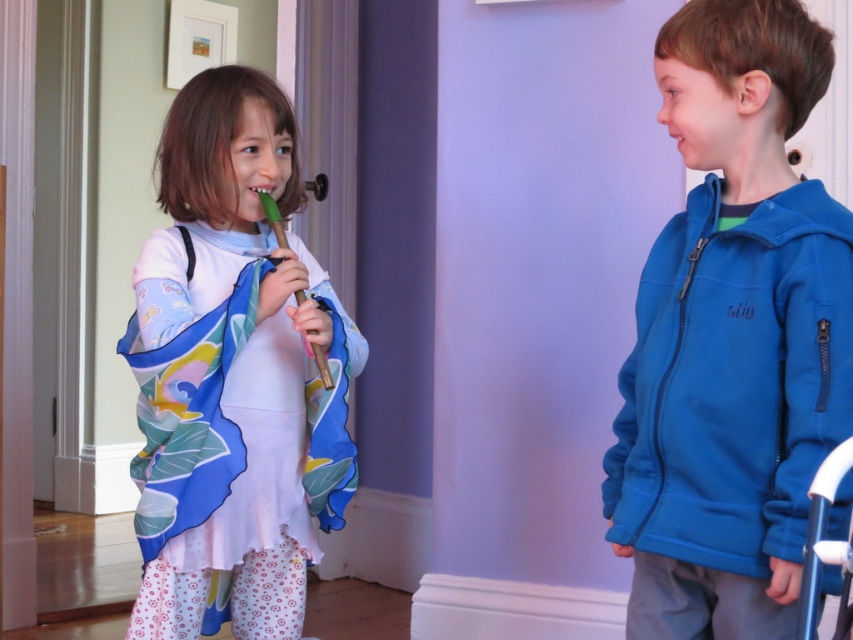
Question: Can you confirm if blue fleece jacket at right is thinner than pink matte mouth at upper center?

Choices:
 (A) no
 (B) yes

Answer: (A)

Question: Is matte green flute at left to the right of pink matte mouth at upper center from the viewer's perspective?

Choices:
 (A) no
 (B) yes

Answer: (A)

Question: Which object appears farthest from the camera in this image?

Choices:
 (A) green wood toothbrush at center
 (B) matte green flute at left

Answer: (A)

Question: Among these points, which one is farthest from the camera?

Choices:
 (A) (276, 234)
 (B) (683, 138)
 (C) (851, 257)
 (D) (350, 467)

Answer: (D)

Question: Does blue fleece jacket at right have a smaller size compared to green wood toothbrush at center?

Choices:
 (A) yes
 (B) no

Answer: (B)

Question: Which of these objects is positioned farthest from the green wood toothbrush at center?

Choices:
 (A) matte green flute at left
 (B) blue fleece jacket at right
 (C) pink matte mouth at upper center

Answer: (C)